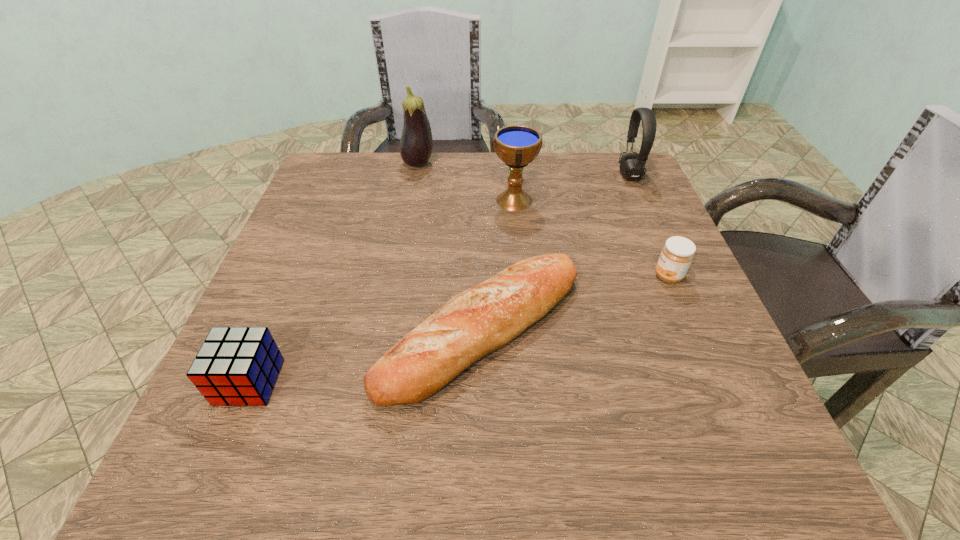
Where is `vacant space in between the baguet and the headset`? Image resolution: width=960 pixels, height=540 pixels. vacant space in between the baguet and the headset is located at coordinates (556, 253).

The width and height of the screenshot is (960, 540). I want to click on unoccupied area between the eggplant and the headset, so click(x=524, y=170).

Identify the location of vacant region between the chalice and the cube. This screenshot has height=540, width=960. (382, 291).

This screenshot has height=540, width=960. Identify the location of free space between the baguet and the tallest object. (450, 247).

At what (x,y) coordinates should I click in order to perform the action: click on free area in between the jam and the chalice. Please return your answer as a coordinate pair (x, y). Looking at the image, I should click on (591, 238).

Where is `free space between the chalice and the eggplant`? The height and width of the screenshot is (540, 960). free space between the chalice and the eggplant is located at coordinates (467, 182).

I want to click on free spot between the baguet and the leftmost object, so click(366, 356).

Locate an element on the screen. The image size is (960, 540). empty location between the chalice and the baguet is located at coordinates (498, 265).

Select which object is the closest to the leftmost object. Please provide its 2D coordinates. Your answer should be formatted as a tuple, i.e. [(x, y)], where the tuple contains the x and y coordinates of a point satisfying the conditions above.

[(484, 318)]

Point out which object is positioned as the fifth nearest to the eggplant. Please provide its 2D coordinates. Your answer should be formatted as a tuple, i.e. [(x, y)], where the tuple contains the x and y coordinates of a point satisfying the conditions above.

[(238, 366)]